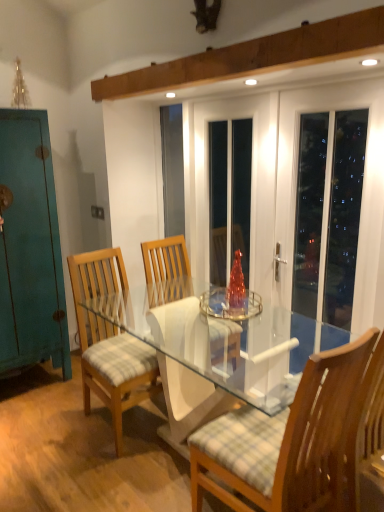
Locate an element on the screen. blank space situated above white glossy door at upper right (from a real-world perspective) is located at coordinates point(335,79).